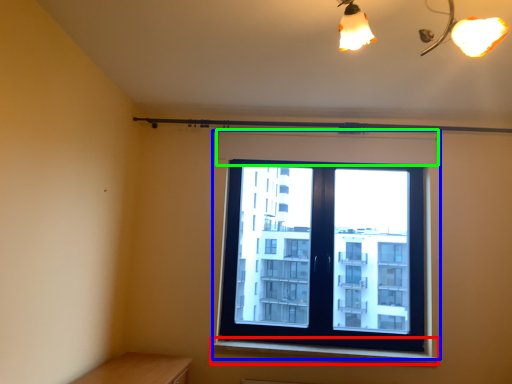
Question: Considering the real-world distances, which object is closest to window sill (highlighted by a red box)? window (highlighted by a blue box) or shutter (highlighted by a green box).

Choices:
 (A) window
 (B) shutter

Answer: (A)